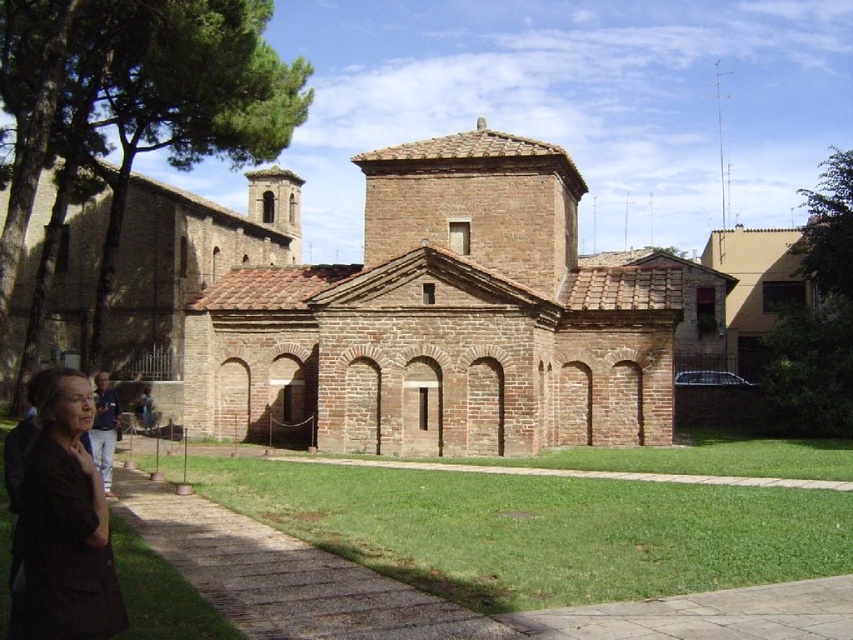
You are standing in front of a historical building. You notice a point marked at coordinates (444, 320). Based on the scene description, what object does this coordinate most likely represent?

The point at coordinates (444, 320) corresponds to the brown brick chapel at center.

You are standing in front of the historical building and want to determine the relative positions of two points marked on the structure. The first point is located at coordinates point (419, 362), and the second is at point (44, 589). Which point is closer to you?

Point (419, 362) is further to the viewer than point (44, 589), so the point closer to you is point (44, 589).